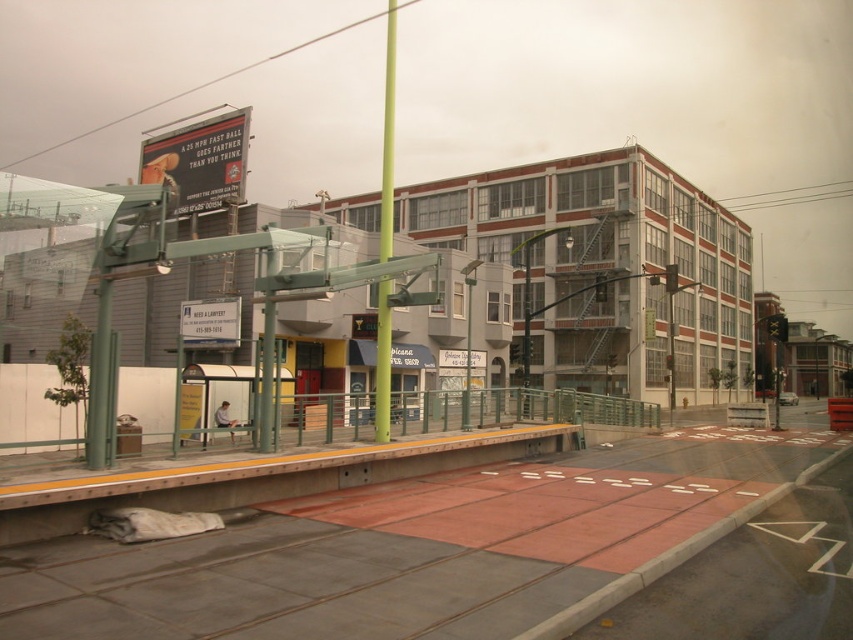
You are a visually impaired person using a white cane. You are standing at the green matte pole at center and want to reach the red rubber train track at lower center. Which direction should you move to get there?

The red rubber train track at lower center is to the right of the green matte pole at center, so you should move to your right to reach it.